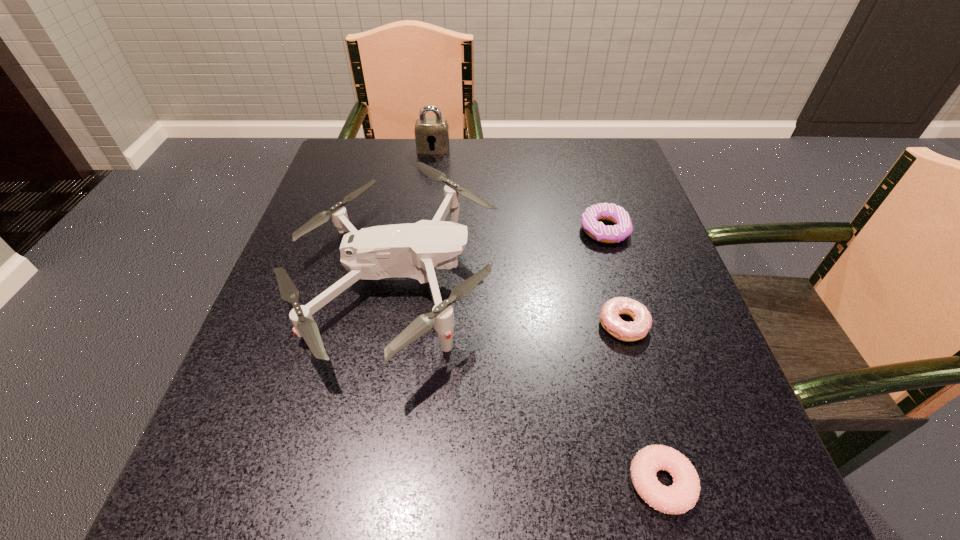
What are the coordinates of `free point that satisfies the following two spatial constraints: 1. with a camera at the front of the second nearest doughnut; 2. on the right side of the drone` in the screenshot? It's located at (386, 325).

I want to click on free location that satisfies the following two spatial constraints: 1. at the front of the padlock near the keyhole; 2. on the right side of the nearest doughnut, so click(x=386, y=483).

Find the location of `vacant area that satisfies the following two spatial constraints: 1. at the front of the farthest object near the keyhole; 2. with a camera at the front of the drone`. vacant area that satisfies the following two spatial constraints: 1. at the front of the farthest object near the keyhole; 2. with a camera at the front of the drone is located at coordinates (415, 283).

Find the location of `vacant position in the image that satisfies the following two spatial constraints: 1. with a camera at the front of the second nearest doughnut; 2. on the right side of the drone`. vacant position in the image that satisfies the following two spatial constraints: 1. with a camera at the front of the second nearest doughnut; 2. on the right side of the drone is located at coordinates (386, 325).

I want to click on free space in the image that satisfies the following two spatial constraints: 1. with a camera at the front of the nearest doughnut; 2. on the right side of the drone, so click(356, 483).

Identify the location of free space that satisfies the following two spatial constraints: 1. at the front of the padlock near the keyhole; 2. on the right side of the nearest object. The height and width of the screenshot is (540, 960). (386, 483).

Locate an element on the screen. free location that satisfies the following two spatial constraints: 1. at the front of the padlock near the keyhole; 2. on the left side of the second nearest doughnut is located at coordinates (408, 325).